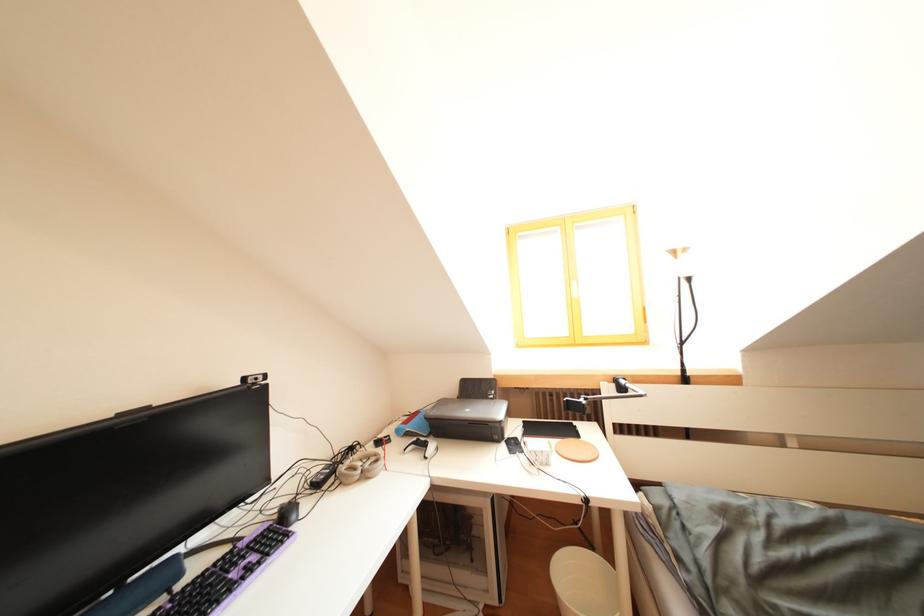
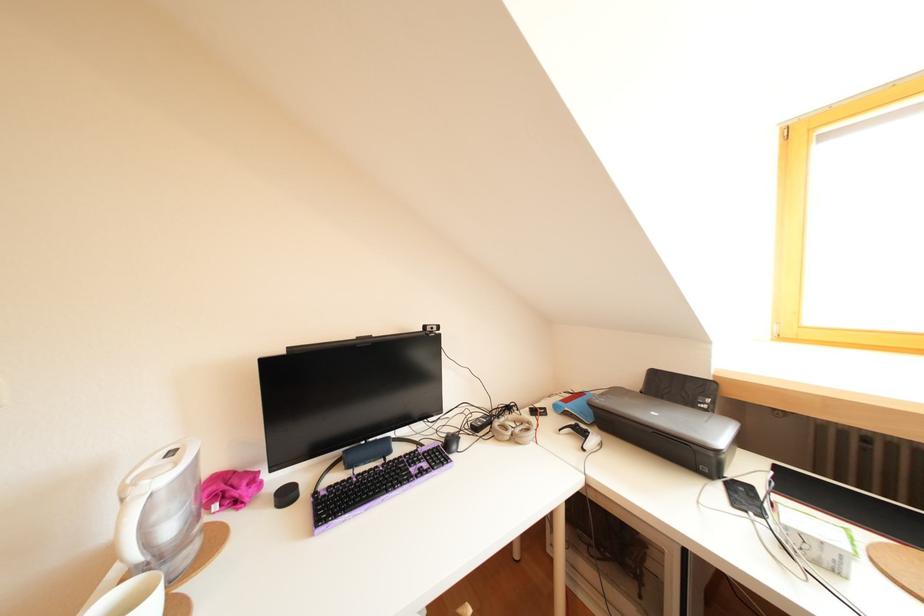
In the second image, find the point that corresponds to pixel 359 454 in the first image.

(516, 413)